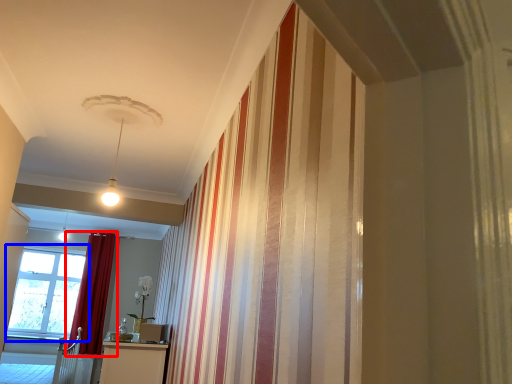
Question: Among these objects, which one is nearest to the camera, curtain (highlighted by a red box) or window (highlighted by a blue box)?

Choices:
 (A) curtain
 (B) window

Answer: (A)